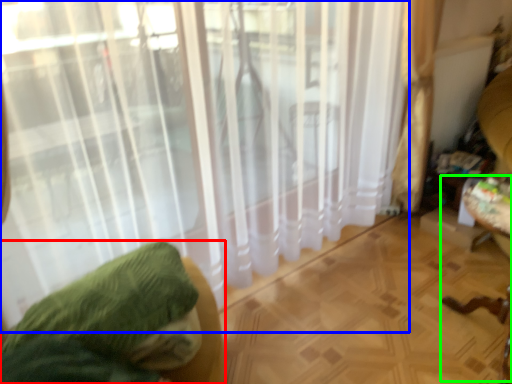
Question: Which object is the closest to the furniture (highlighted by a red box)? Choose among these: curtain (highlighted by a blue box) or swivel chair (highlighted by a green box).

Choices:
 (A) curtain
 (B) swivel chair

Answer: (A)